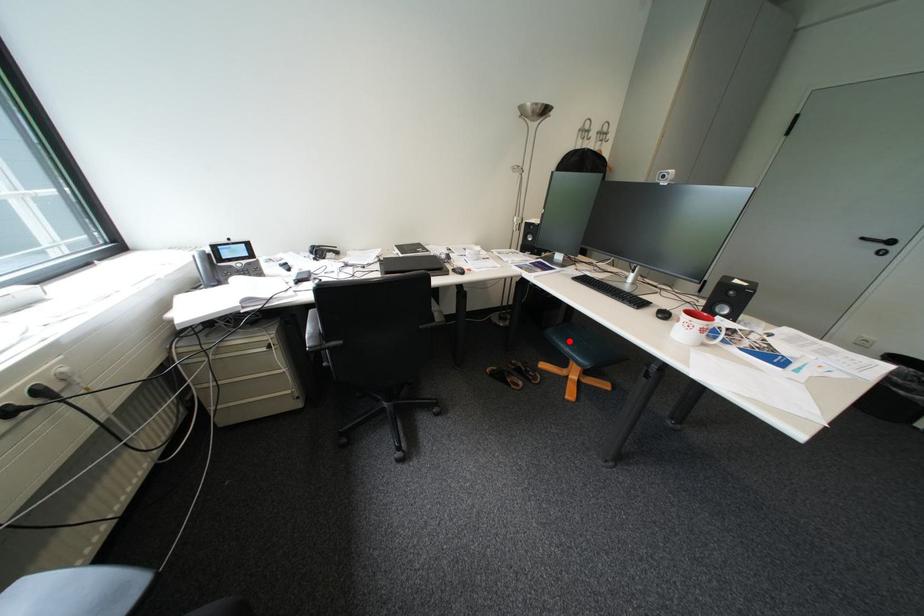
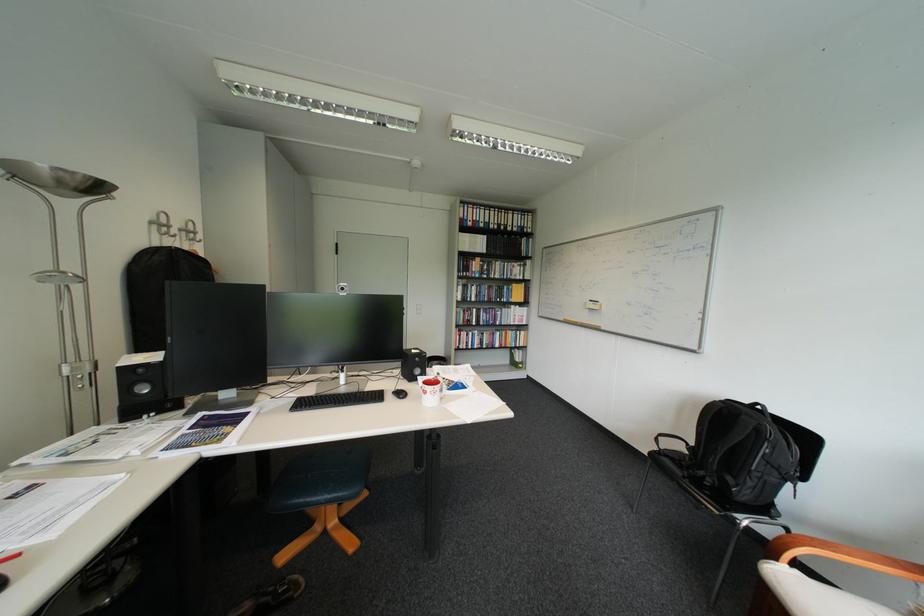
The point at the highlighted location is marked in the first image. Where is the corresponding point in the second image?

(313, 501)